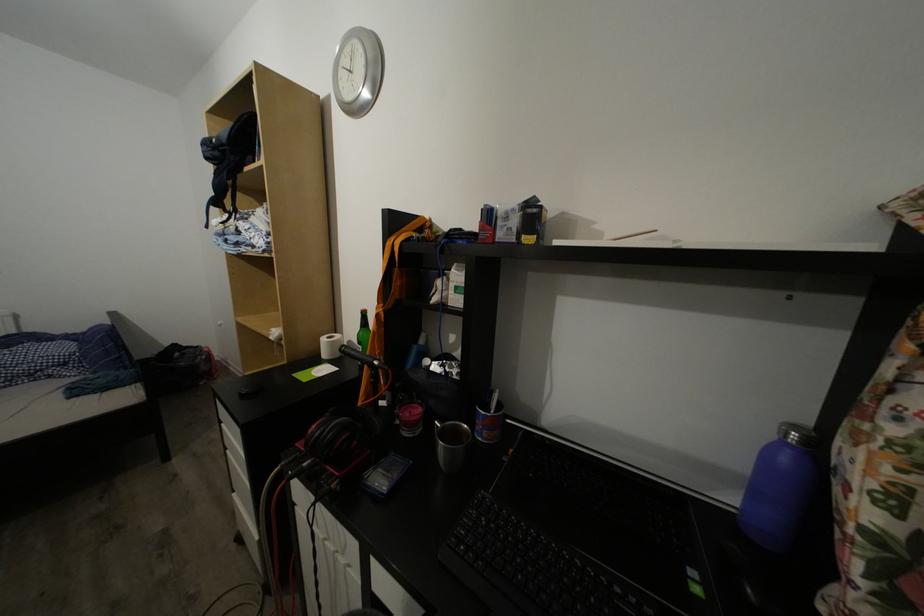
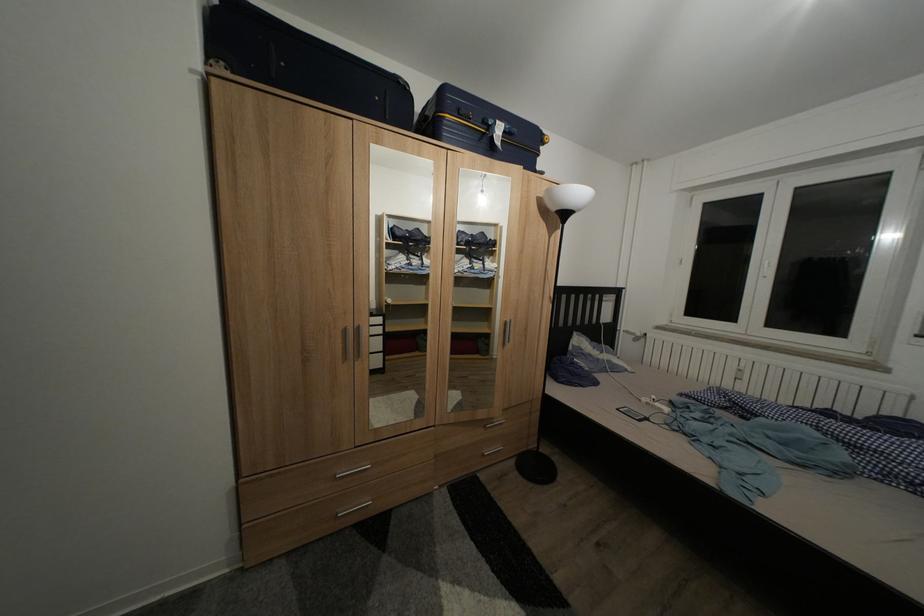
Question: The first image is from the beginning of the video and the second image is from the end. How did the camera likely rotate when shooting the video?

Choices:
 (A) Left
 (B) Right
 (C) Up
 (D) Down

Answer: (A)